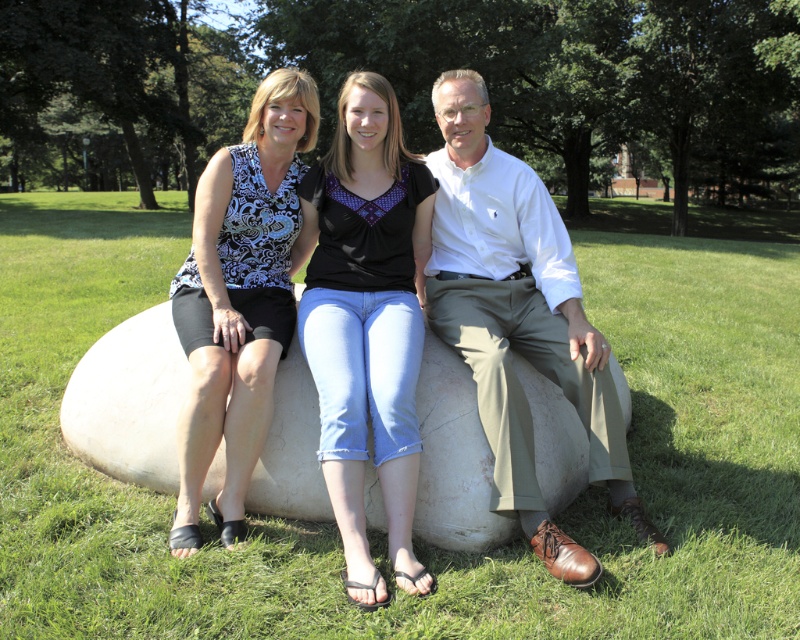
This screenshot has height=640, width=800. I want to click on green grass at center, so click(x=416, y=541).

In the scene shown: Between green grass at center and matte white stone at center, which one is positioned higher?

Result: green grass at center is above.

Find the location of `green grass at center`. green grass at center is located at coordinates (416, 541).

Measure the distance between matte white stone at center and matte black tank top at left.

matte white stone at center and matte black tank top at left are 31.34 inches apart from each other.

Looking at this image, is matte white stone at center to the left of matte black tank top at left from the viewer's perspective?

In fact, matte white stone at center is to the right of matte black tank top at left.

Who is more distant from viewer, (350, 480) or (262, 109)?

The point (262, 109) is behind.

Where is `matte white stone at center`? This screenshot has width=800, height=640. matte white stone at center is located at coordinates (x=440, y=337).

Is light brown leather pants at center bigger than matte black tank top at left?

Correct, light brown leather pants at center is larger in size than matte black tank top at left.

The height and width of the screenshot is (640, 800). Identify the location of light brown leather pants at center. (518, 321).